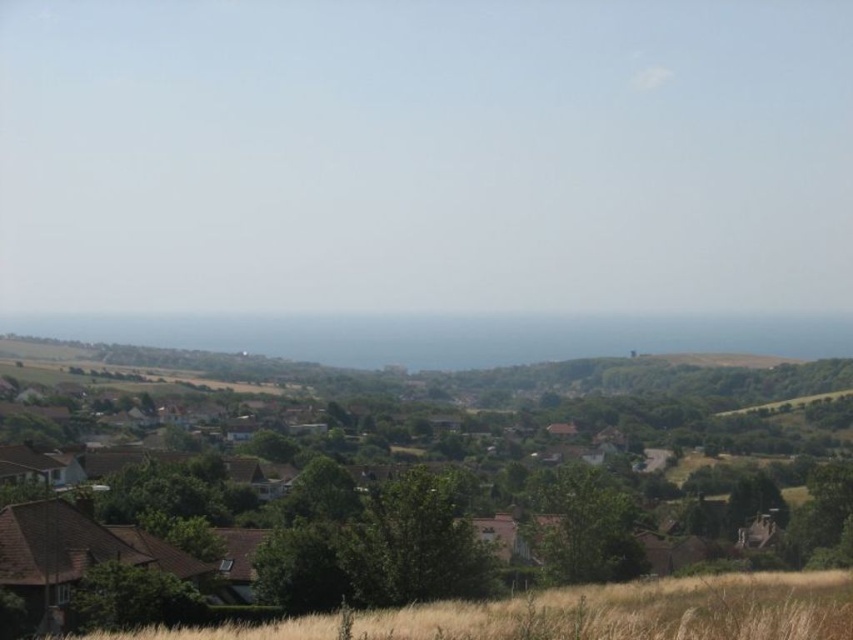
Question: Which of the following is the farthest from the observer?

Choices:
 (A) (227, 340)
 (B) (263, 636)

Answer: (A)

Question: Is brown wooden houses at center below dry grass at lower center?

Choices:
 (A) yes
 (B) no

Answer: (A)

Question: Which of the following is the closest to the observer?

Choices:
 (A) (572, 356)
 (B) (773, 611)
 (C) (252, 618)

Answer: (B)

Question: Is blue ocean at center to the left of dry grass at lower center from the viewer's perspective?

Choices:
 (A) no
 (B) yes

Answer: (B)

Question: Which point is farther to the camera?

Choices:
 (A) dry grass at lower center
 (B) blue ocean at center
 (C) brown wooden houses at center

Answer: (B)

Question: Is brown wooden houses at center to the left of dry grass at lower center from the viewer's perspective?

Choices:
 (A) yes
 (B) no

Answer: (A)